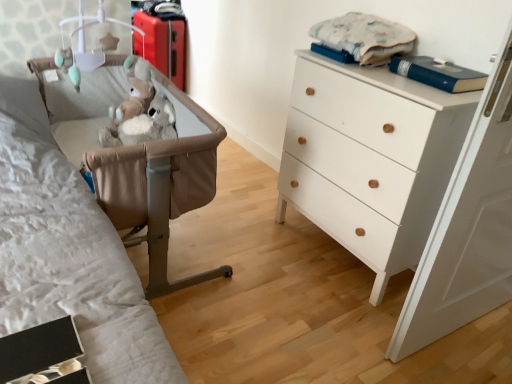
Locate an element on the screen. Image resolution: width=512 pixels, height=384 pixels. free space between tan leather crib at left and white wood chest of drawers at right is located at coordinates (259, 259).